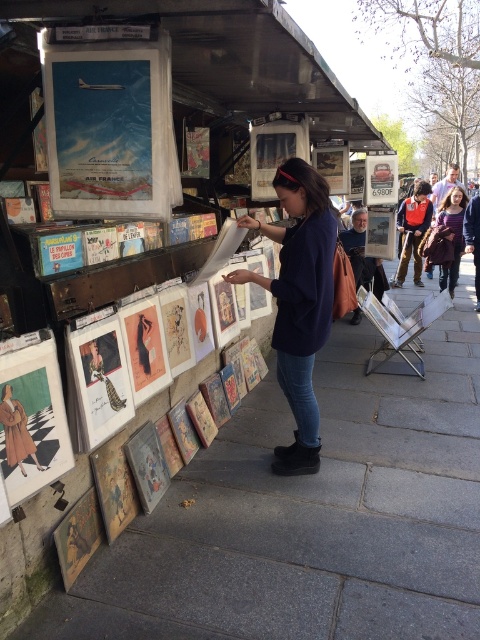
Question: Does dark blue sweater at center lie in front of jeans at center?

Choices:
 (A) no
 (B) yes

Answer: (B)

Question: Among these objects, which one is nearest to the camera?

Choices:
 (A) blue denim jeans at center
 (B) dark blue sweater at center
 (C) jeans at center
 (D) striped sweater at center

Answer: (B)

Question: Can you confirm if jeans at center is bigger than striped sweater at center?

Choices:
 (A) no
 (B) yes

Answer: (A)

Question: Is dark blue sweater at center above striped sweater at center?

Choices:
 (A) yes
 (B) no

Answer: (B)

Question: Which object appears closest to the camera in this image?

Choices:
 (A) striped sweater at center
 (B) blue denim jeans at center
 (C) jeans at center

Answer: (C)

Question: Which object is closer to the camera taking this photo?

Choices:
 (A) dark blue sweater at center
 (B) striped sweater at center
 (C) smooth concrete pavement at center

Answer: (C)